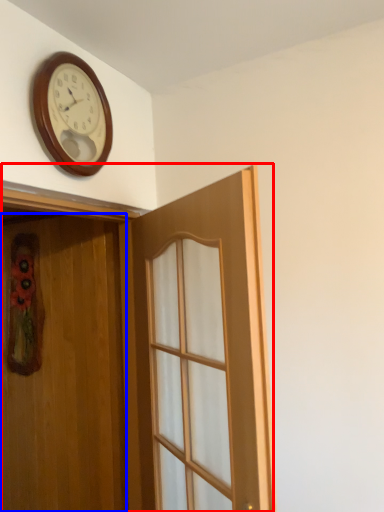
Question: Which object appears closest to the camera in this image, door (highlighted by a red box) or door (highlighted by a blue box)?

Choices:
 (A) door
 (B) door

Answer: (A)